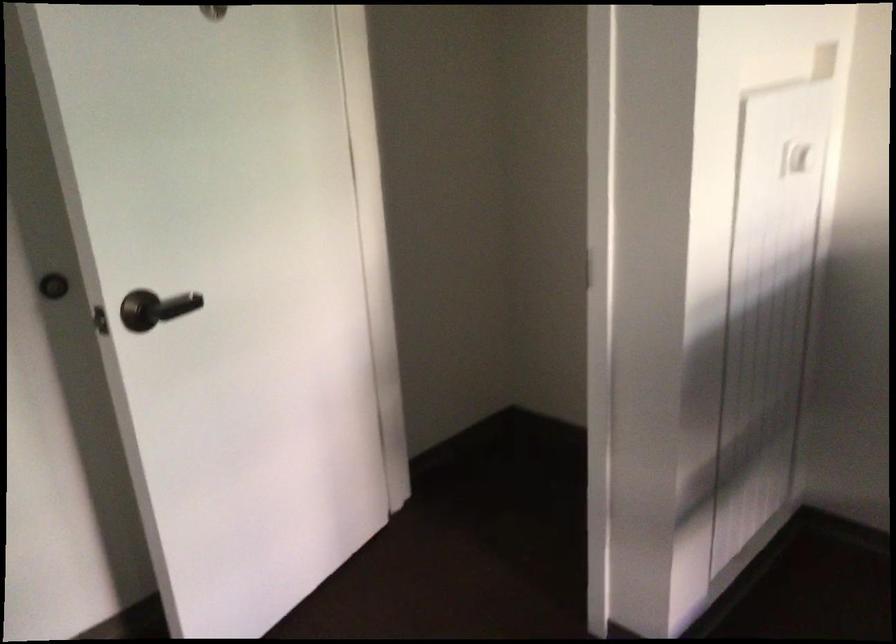
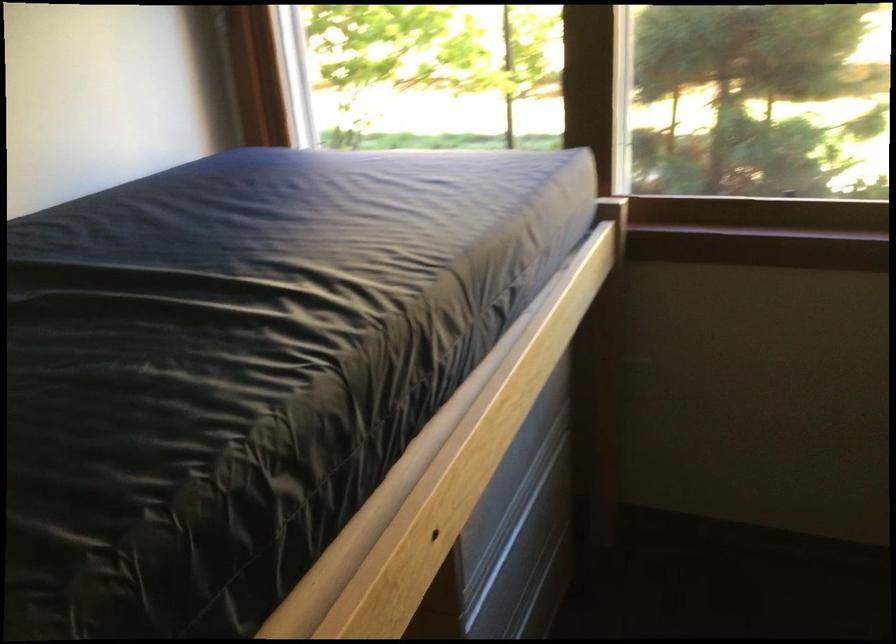
First-person continuous shooting, in which direction is the camera rotating?

The camera's rotation is toward right-down.